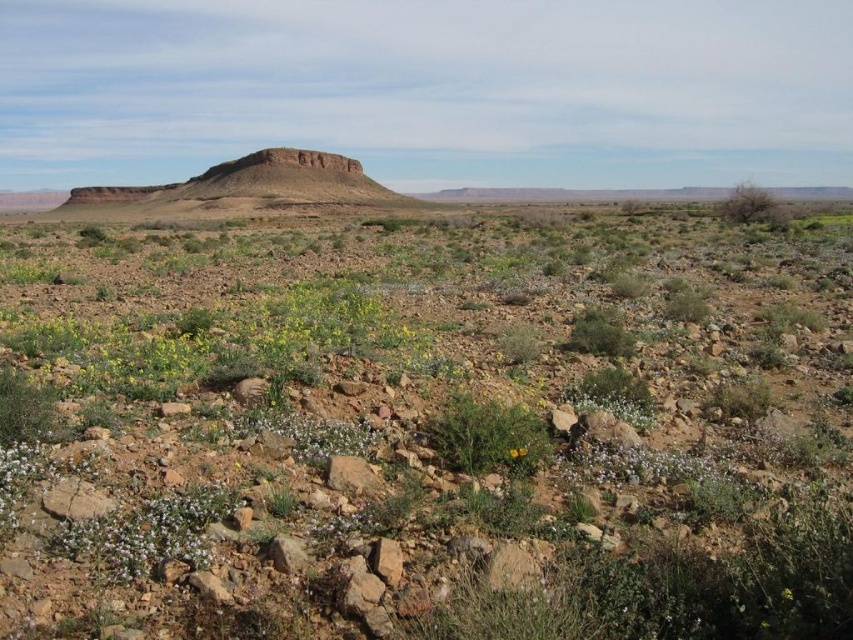
Looking at this image, you are a hiker planning to take a photo of the rustic rock formation at center and the brown rocky hill at upper center. Which of the two geological features should you position closer to the camera to ensure both are in focus?

The rustic rock formation at center is taller than the brown rocky hill at upper center. To ensure both are in focus, you should position the rustic rock formation at center closer to the camera since it is taller and requires more depth of field.

You are a hiker trying to navigate the desert. You see the brown rocky hill at upper center and the rustic rock formation at center. Which one is nearer to you?

The brown rocky hill at upper center is closer to the viewer than the rustic rock formation at center.

You are a hiker in the desert and need to decide which object to use for shade. The rustic rock formation at center and the green leafy plant at center are both in your path. Which one would provide a larger shaded area based on their widths?

The rustic rock formation at center has a greater width than the green leafy plant at center, so it would provide a larger shaded area.